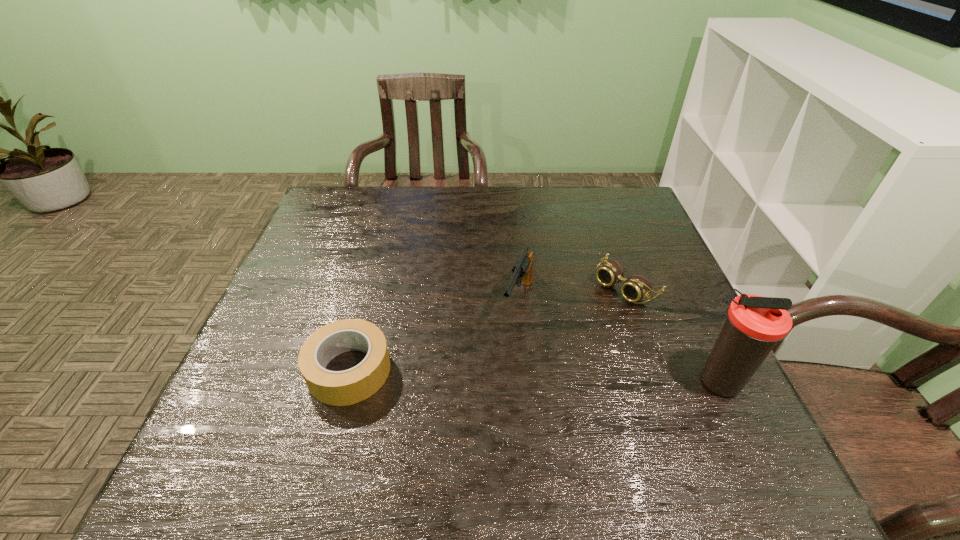
I want to click on free space located through the lenses of the goggles, so click(532, 359).

You are a GUI agent. You are given a task and a screenshot of the screen. Output one action in this format:
    pyautogui.click(x=<x>, y=<y>)
    Task: Click on the free location located 0.130m along the barrel of the third shortest object
    
    Given the screenshot: What is the action you would take?
    pyautogui.click(x=496, y=375)

This screenshot has height=540, width=960. I want to click on free space located along the barrel of the third shortest object, so click(x=505, y=354).

Identify the location of free space located 0.230m along the barrel of the third shortest object. (480, 415).

The height and width of the screenshot is (540, 960). I want to click on duct tape located at the near edge, so click(337, 388).

You are a GUI agent. You are given a task and a screenshot of the screen. Output one action in this format:
    pyautogui.click(x=<x>, y=<y>)
    Task: Click on the thermos bottle that is at the near edge
    
    Given the screenshot: What is the action you would take?
    pyautogui.click(x=754, y=324)

Where is `object that is at the left edge`? This screenshot has width=960, height=540. object that is at the left edge is located at coordinates (337, 388).

Locate an element on the screen. The image size is (960, 540). thermos bottle that is at the right edge is located at coordinates (754, 324).

You are a GUI agent. You are given a task and a screenshot of the screen. Output one action in this format:
    pyautogui.click(x=<x>, y=<y>)
    Task: Click on the goggles located in the right edge section of the desktop
    The width and height of the screenshot is (960, 540).
    Given the screenshot: What is the action you would take?
    pyautogui.click(x=635, y=288)

At what (x,y) coordinates should I click in order to perform the action: click on object that is at the near left corner. Please return your answer as a coordinate pair (x, y). This screenshot has width=960, height=540. Looking at the image, I should click on (337, 388).